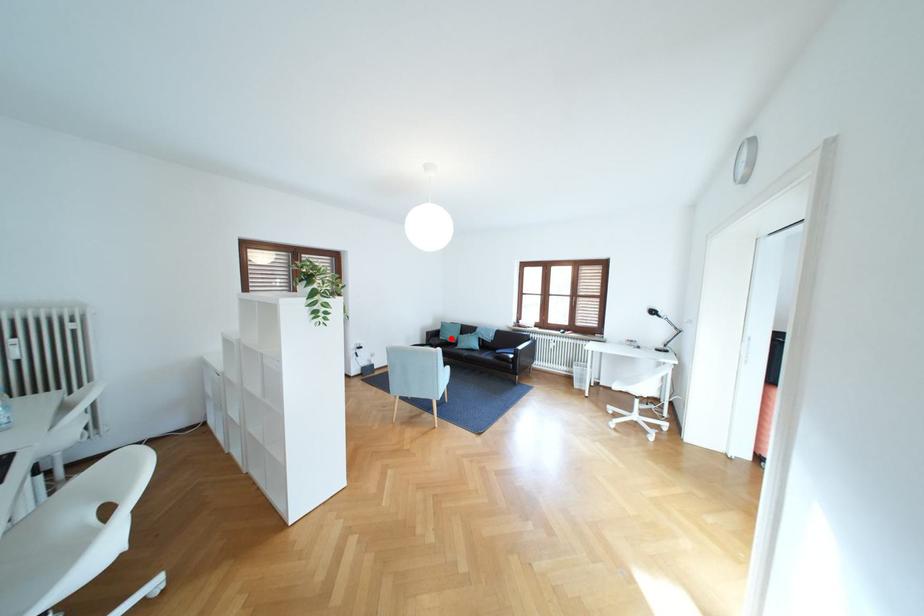
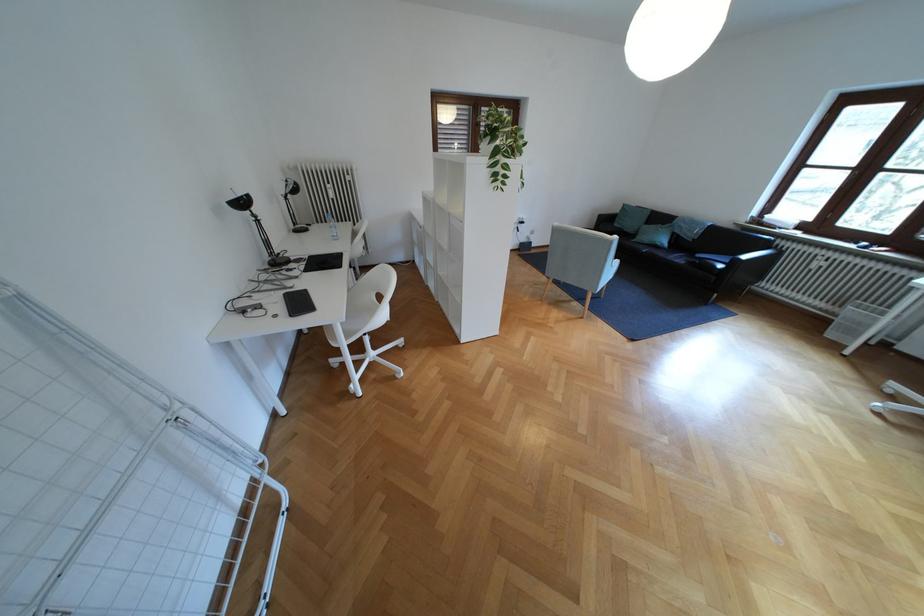
Question: I am providing you with two images of the same scene from different viewpoints. Given a red point in image1, look at the same physical point in image2. Is it:

Choices:
 (A) Closer to the viewpoint
 (B) Farther from the viewpoint

Answer: (B)